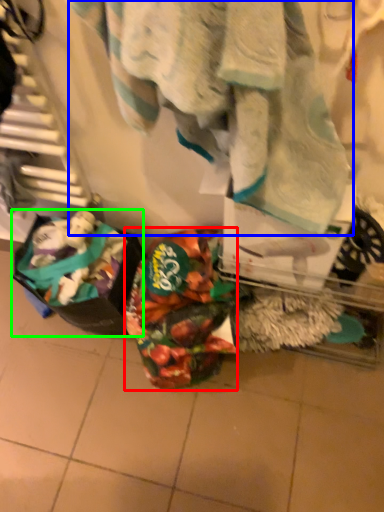
Question: Based on their relative distances, which object is nearer to waste (highlighted by a red box)? Choose from towel (highlighted by a blue box) and waste (highlighted by a green box).

Choices:
 (A) towel
 (B) waste

Answer: (B)